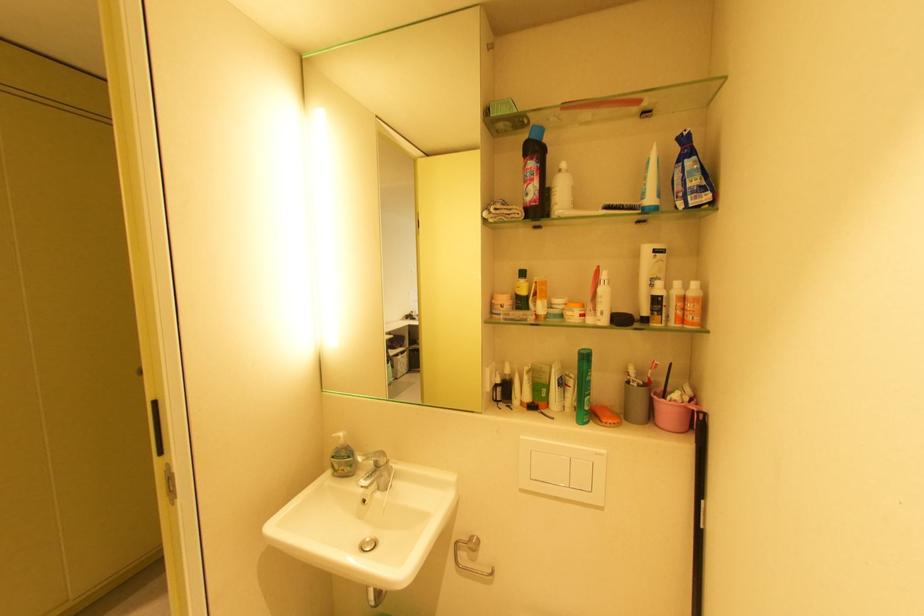
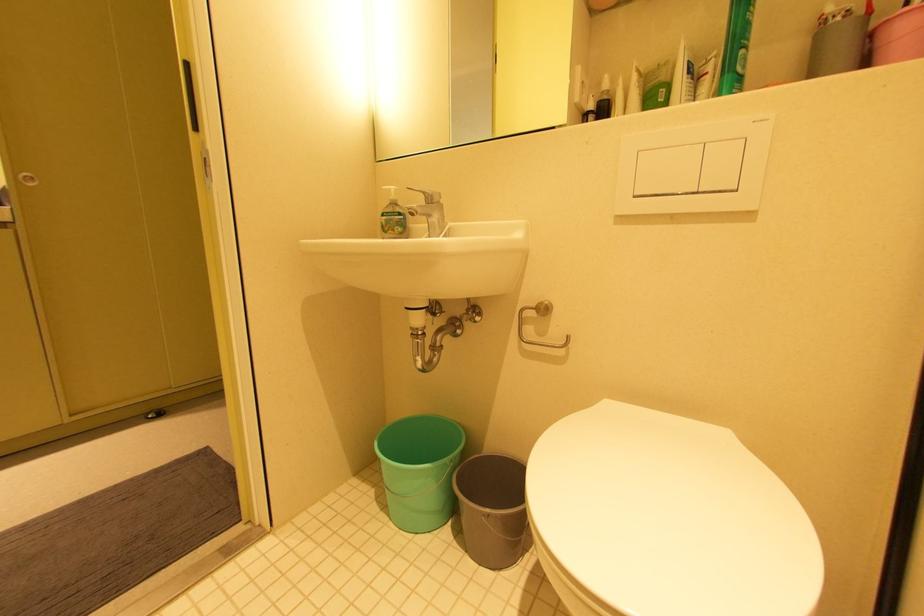
Question: The images are taken continuously from a first-person perspective. In which direction is your viewpoint rotating?

Choices:
 (A) Left
 (B) Right
 (C) Up
 (D) Down

Answer: (A)